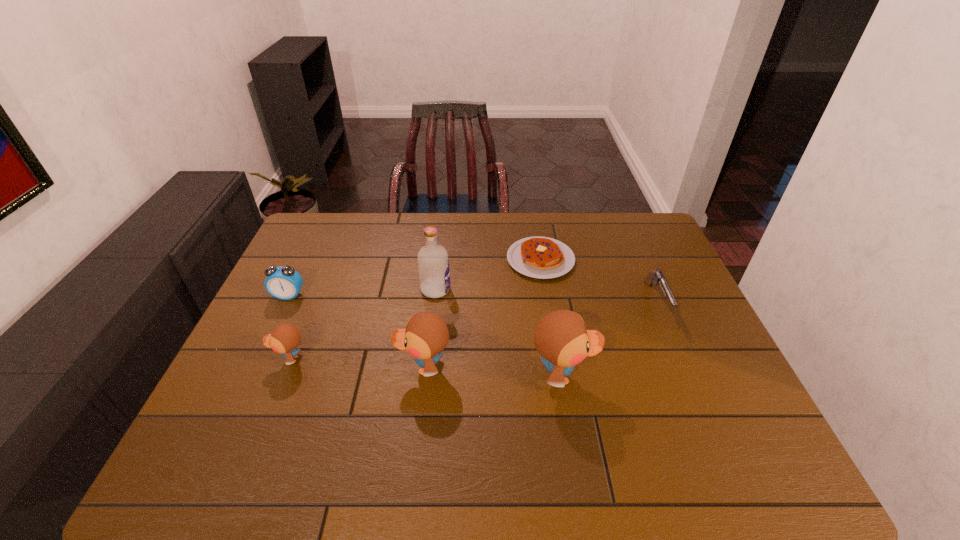
Where is `vacant region between the second shortest object and the leftmost duck`? vacant region between the second shortest object and the leftmost duck is located at coordinates (473, 330).

Identify the location of object identified as the sixth closest to the rightmost object. (283, 282).

Point out which object is positioned as the fifth nearest to the vodka. Please provide its 2D coordinates. Your answer should be formatted as a tuple, i.e. [(x, y)], where the tuple contains the x and y coordinates of a point satisfying the conditions above.

[(283, 282)]

Locate an element on the screen. This screenshot has width=960, height=540. duck that stands as the second closest to the rightmost object is located at coordinates (426, 334).

What are the coordinates of `the second closest duck to the rightmost duck` in the screenshot? It's located at (285, 338).

This screenshot has width=960, height=540. What are the coordinates of `free space that satisfies the following two spatial constraints: 1. aiming along the barrel of the sixth tallest object; 2. on the front-facing side of the third tallest object` in the screenshot? It's located at (685, 367).

Where is `vacant area that satisfies the following two spatial constraints: 1. on the label of the vodka; 2. on the face of the alarm clock`? This screenshot has width=960, height=540. vacant area that satisfies the following two spatial constraints: 1. on the label of the vodka; 2. on the face of the alarm clock is located at coordinates (435, 295).

Locate an element on the screen. The image size is (960, 540). vacant position in the image that satisfies the following two spatial constraints: 1. aiming along the barrel of the gun; 2. on the front-facing side of the rightmost duck is located at coordinates (689, 376).

This screenshot has width=960, height=540. In order to click on free space in the image that satisfies the following two spatial constraints: 1. aiming along the barrel of the gun; 2. on the front-facing side of the shortest duck in this screenshot , I will do `click(682, 359)`.